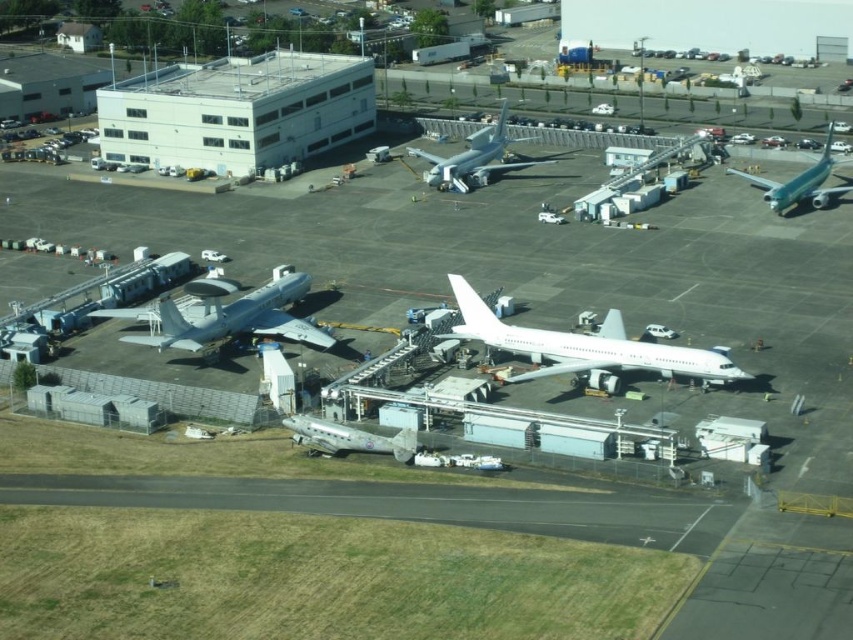
Question: Does white matte building at upper left lie behind metallic silver airplane at center?

Choices:
 (A) no
 (B) yes

Answer: (B)

Question: Among these objects, which one is farthest from the camera?

Choices:
 (A) metallic silver airplane at center
 (B) white matte airplane at center
 (C) white matte building at upper left
 (D) black asphalt runway at lower center

Answer: (C)

Question: Can you confirm if black asphalt runway at lower center is positioned below white matte building at upper left?

Choices:
 (A) yes
 (B) no

Answer: (A)

Question: Which point appears farthest from the camera in this image?

Choices:
 (A) (291, 273)
 (B) (28, 497)

Answer: (A)

Question: Estimate the real-world distances between objects in this image. Which object is closer to the metallic silver airplane at center?

Choices:
 (A) metallic silver airplane at right
 (B) white matte airplane at center
 (C) white glossy airplane at center
 (D) white matte building at upper left

Answer: (B)

Question: Is white glossy airplane at center positioned in front of metallic silver airplane at right?

Choices:
 (A) no
 (B) yes

Answer: (A)